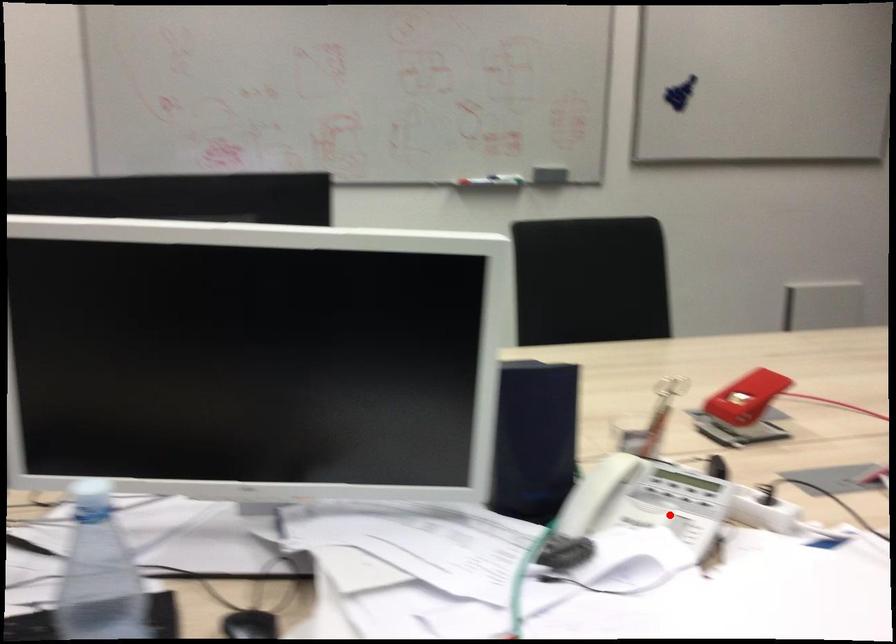
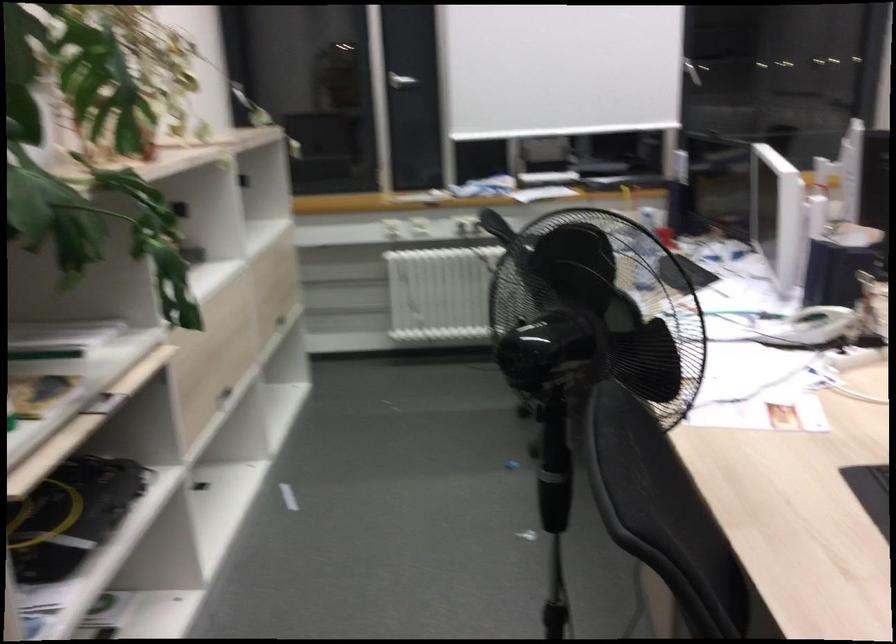
In the second image, find the point that corresponds to the highlighted location in the first image.

(811, 327)